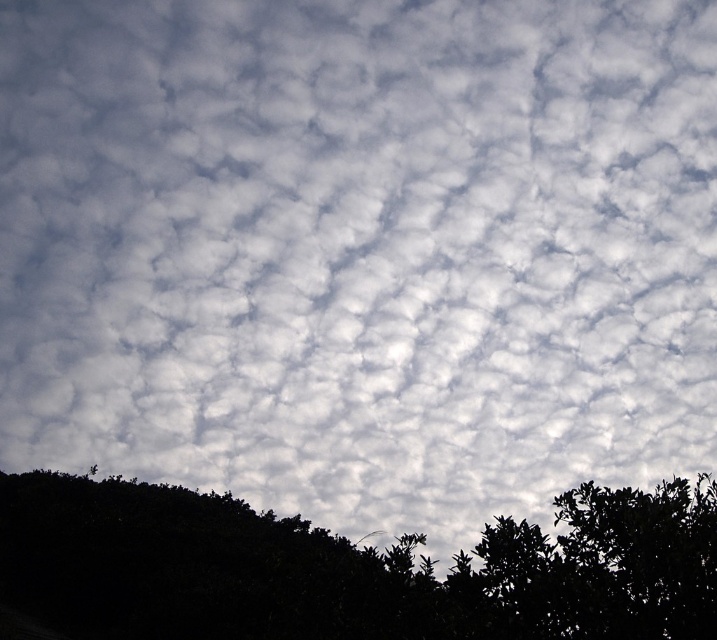
Question: Among these objects, which one is farthest from the camera?

Choices:
 (A) green leafy tree at lower right
 (B) dark green foliage at lower left

Answer: (B)

Question: Observing the image, what is the correct spatial positioning of dark green foliage at lower left in reference to green leafy tree at lower right?

Choices:
 (A) below
 (B) above

Answer: (A)

Question: Is the position of dark green foliage at lower left more distant than that of green leafy tree at lower right?

Choices:
 (A) no
 (B) yes

Answer: (B)

Question: Does dark green foliage at lower left have a larger size compared to green leafy tree at lower right?

Choices:
 (A) yes
 (B) no

Answer: (A)

Question: Which point appears closest to the camera in this image?

Choices:
 (A) (485, 609)
 (B) (360, 611)

Answer: (A)